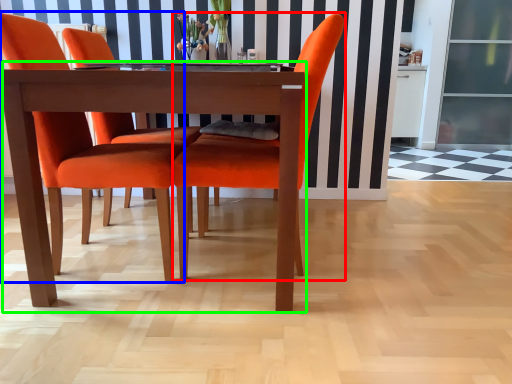
Question: Which object is positioned closest to chair (highlighted by a red box)? Select from chair (highlighted by a blue box) and kitchen & dining room table (highlighted by a green box).

Choices:
 (A) chair
 (B) kitchen & dining room table

Answer: (B)